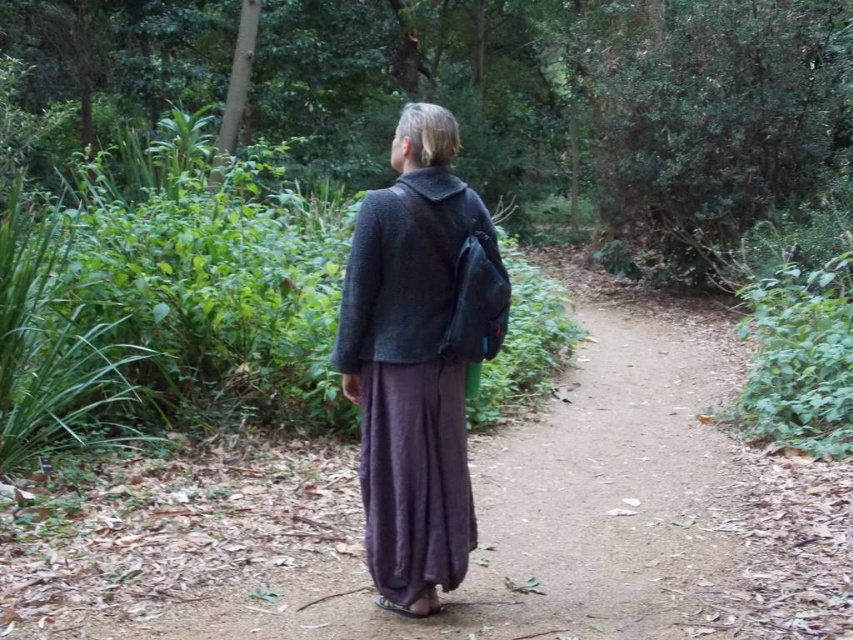
Does dark gray fabric jacket at center appear under dark gray woolen jacket at center?

Indeed, dark gray fabric jacket at center is positioned under dark gray woolen jacket at center.

Can you confirm if dark gray fabric jacket at center is wider than dark gray woolen jacket at center?

Indeed, dark gray fabric jacket at center has a greater width compared to dark gray woolen jacket at center.

Between point (381, 288) and point (426, 205), which one is positioned in front?

Point (426, 205) is more forward.

Locate an element on the screen. Image resolution: width=853 pixels, height=640 pixels. dark gray fabric jacket at center is located at coordinates (418, 358).